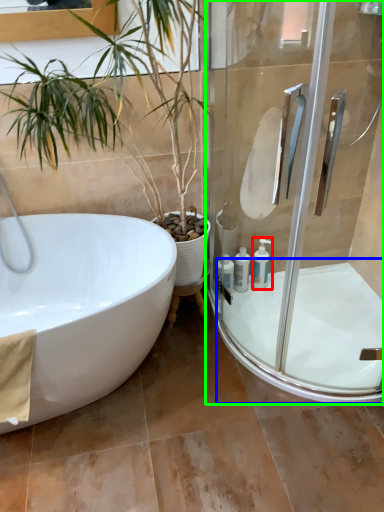
Question: Estimate the real-world distances between objects in this image. Which object is closer to toiletry (highlighted by a red box), bath (highlighted by a blue box) or shower door (highlighted by a green box)?

Choices:
 (A) bath
 (B) shower door

Answer: (A)